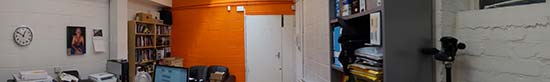
Identify the location of wall. This screenshot has width=550, height=82. (54, 47).